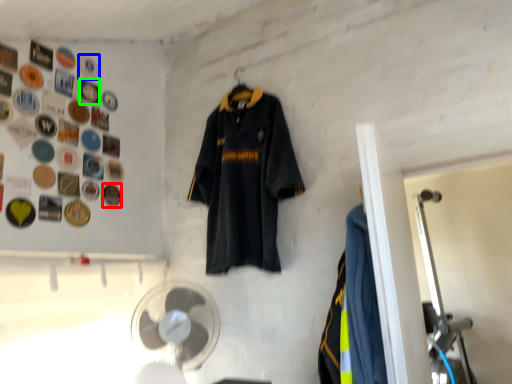
Question: Considering the real-world distances, which object is closest to button (highlighted by a red box)? button (highlighted by a blue box) or button (highlighted by a green box).

Choices:
 (A) button
 (B) button

Answer: (B)